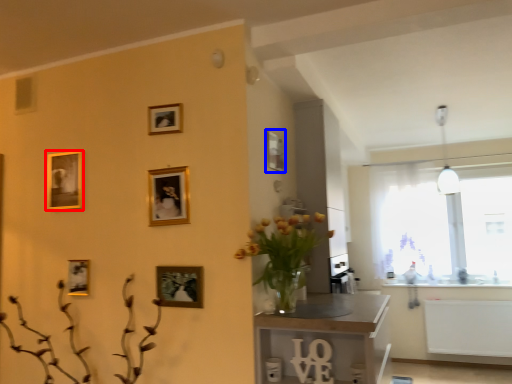
Question: Which object is closer to the camera taking this photo, picture frame (highlighted by a red box) or decorative picture (highlighted by a blue box)?

Choices:
 (A) picture frame
 (B) decorative picture

Answer: (B)